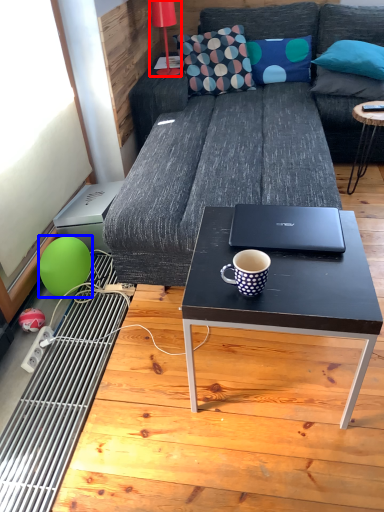
Question: Which point is closer to the camera, lamp (highlighted by a red box) or teal (highlighted by a blue box)?

Choices:
 (A) lamp
 (B) teal

Answer: (B)